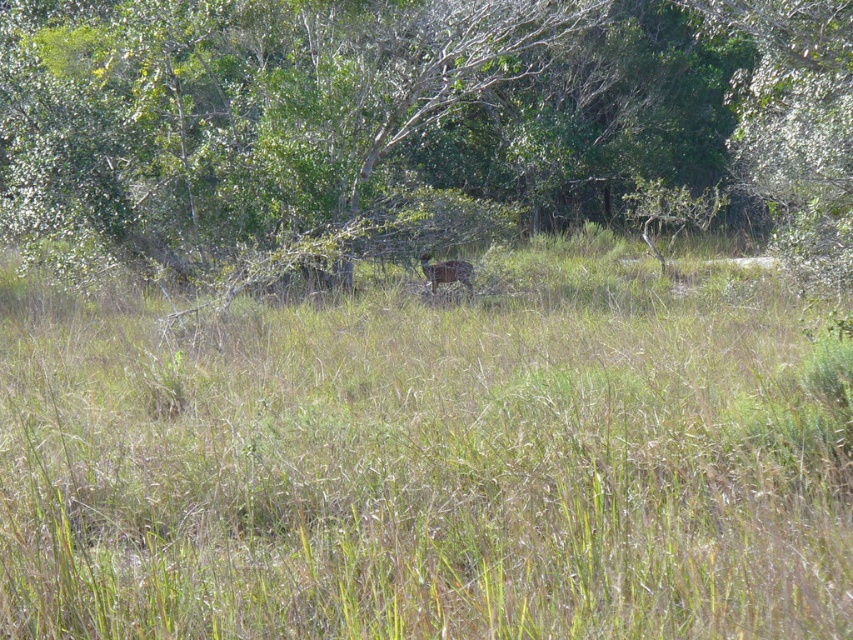
Looking at this image, does green grassy at center lie behind brown fur deer at center?

No, green grassy at center is in front of brown fur deer at center.

Is green grassy at center to the right of brown fur deer at center from the viewer's perspective?

Correct, you'll find green grassy at center to the right of brown fur deer at center.

Is point (798, 452) less distant than point (450, 273)?

Yes, point (798, 452) is in front of point (450, 273).

Image resolution: width=853 pixels, height=640 pixels. Find the location of `green grassy at center`. green grassy at center is located at coordinates 430,458.

Does green leafy tree at center appear on the right side of brown fur deer at center?

Yes, green leafy tree at center is to the right of brown fur deer at center.

Is green leafy tree at center smaller than brown fur deer at center?

No, green leafy tree at center is not smaller than brown fur deer at center.

At what (x,y) coordinates should I click in order to perform the action: click on green leafy tree at center. Please return your answer as a coordinate pair (x, y). Looking at the image, I should click on (413, 125).

Identify the location of green leafy tree at center. Image resolution: width=853 pixels, height=640 pixels. (413, 125).

Between green grassy at center and green leafy tree at center, which one is positioned lower?

green grassy at center is below.

Is green grassy at center positioned behind green leafy tree at center?

No, green grassy at center is in front of green leafy tree at center.

Between point (473, 513) and point (42, 132), which one is positioned in front?

Positioned in front is point (473, 513).

Identify the location of green grassy at center. (430, 458).